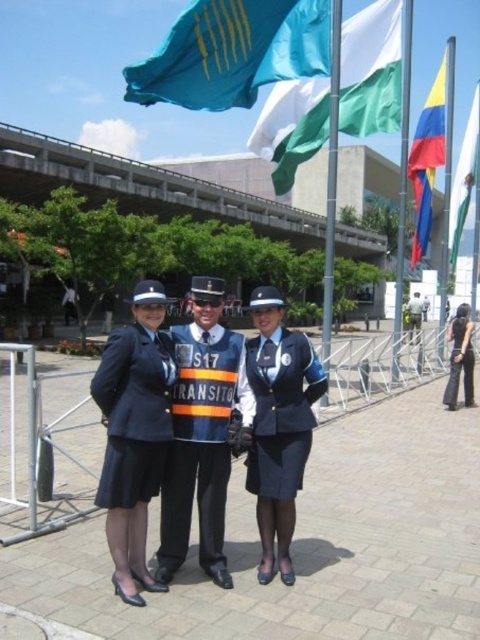
You are a photographer trying to capture a clear shot of both the teal fabric flag at upper center and the green fabric flag at upper right. Based on their positions, which flag should you focus on first to ensure both are in frame without moving the camera?

The teal fabric flag at upper center is located below the green fabric flag at upper right, so you should focus on the green fabric flag at upper right first to ensure both are in frame without moving the camera.

You are a photographer trying to capture a photo of the teal fabric flag at upper center and the green fabric flag at upper right. Since you want both flags to appear equally tall in your photo, which flag should you move closer to, and in which direction should you adjust your position?

To make both flags appear equally tall in the photo, you should move closer to the teal fabric flag at upper center since it has a lesser height compared to the green fabric flag at upper right. By moving closer to the smaller flag, its apparent size in the photo will increase, balancing it with the taller green flag.

You are a photographer trying to capture the teal fabric flag at upper center in your shot. Based on the scene description, where should you position your camera to ensure the flag is centered in your frame?

Position your camera at point (232, 52) to center the teal fabric flag at upper center in your frame.